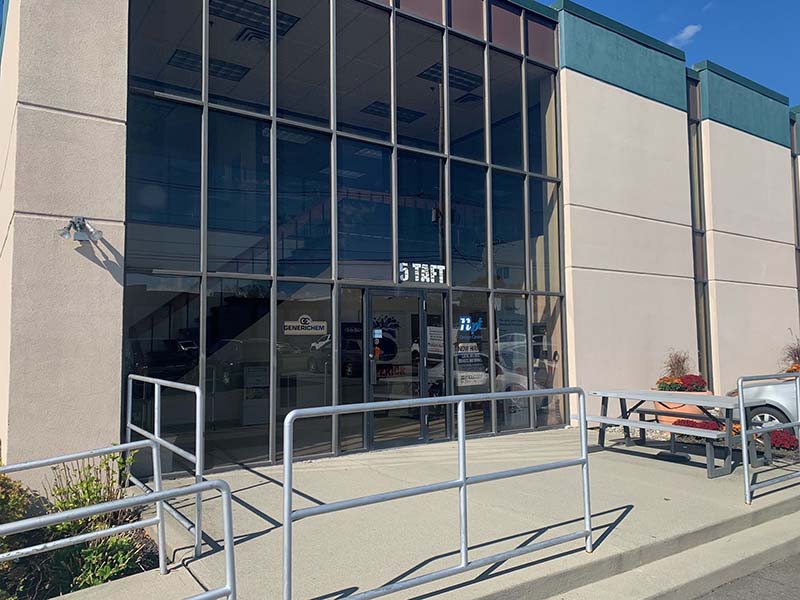
Find the location of a particular element. The width and height of the screenshot is (800, 600). lights is located at coordinates 86,238.